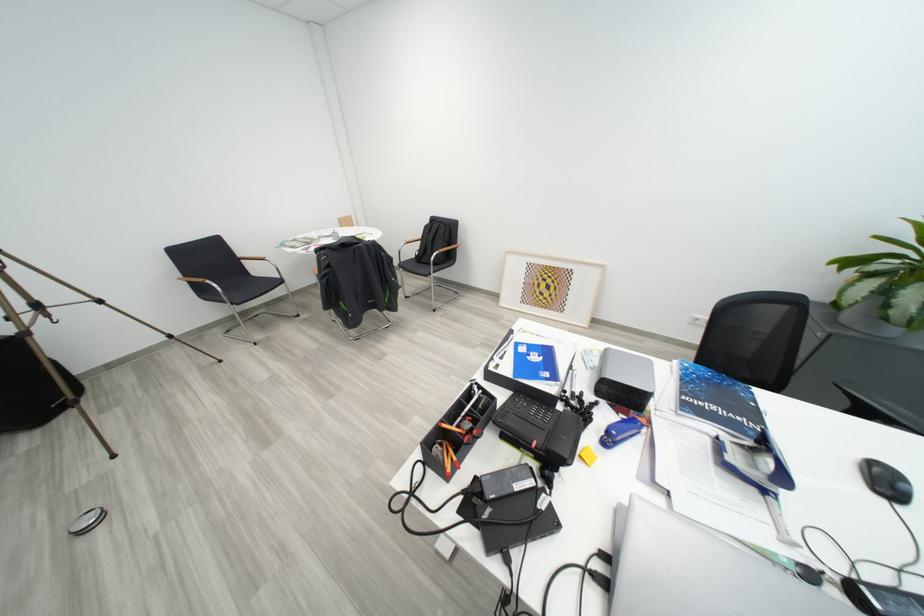
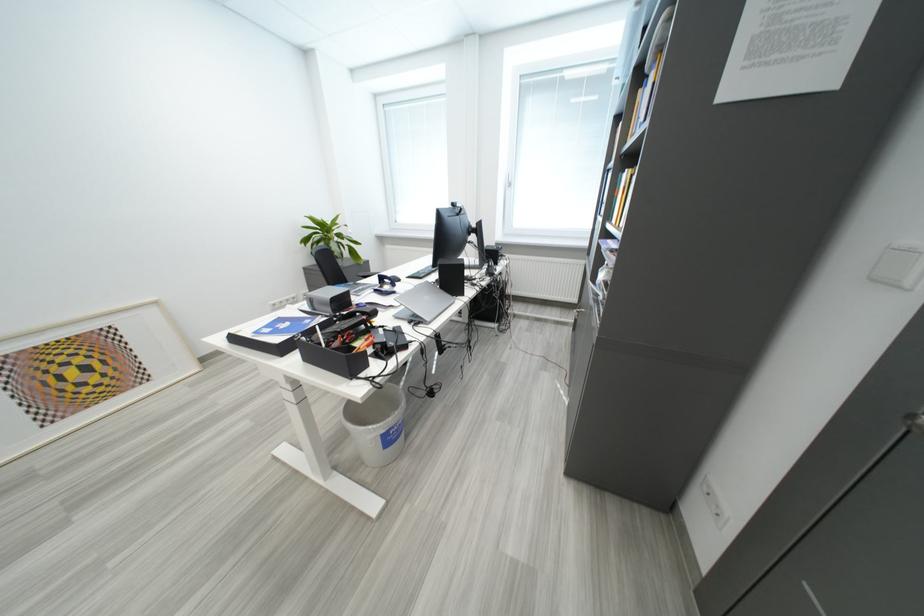
Question: I am providing you with two images of the same scene from different viewpoints. Which of the following objects are not visible in image2?

Choices:
 (A) black desk tray
 (B) blue stapler
 (C) green sticky note
 (D) yellow book

Answer: (B)